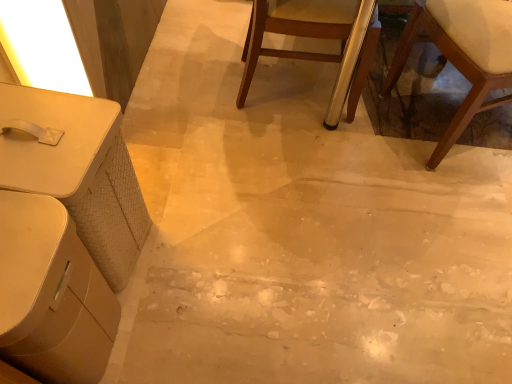
Question: Can you confirm if wooden chair at center, the 2th chair when ordered from right to left, is shorter than wooden chair with white cushion at lower right, which is counted as the second chair, starting from the left?

Choices:
 (A) no
 (B) yes

Answer: (B)

Question: Is wooden chair at center, the 2th chair when ordered from right to left, further to the viewer compared to wooden chair with white cushion at lower right, which is counted as the second chair, starting from the left?

Choices:
 (A) yes
 (B) no

Answer: (A)

Question: Could wooden chair with white cushion at lower right, positioned as the first chair in right-to-left order, be considered to be inside wooden chair at center, marked as the 1th chair in a left-to-right arrangement?

Choices:
 (A) yes
 (B) no

Answer: (B)

Question: Is wooden chair at center, the 2th chair when ordered from right to left, not close to wooden chair with white cushion at lower right, positioned as the first chair in right-to-left order?

Choices:
 (A) yes
 (B) no

Answer: (B)

Question: Can you confirm if wooden chair at center, the 2th chair when ordered from right to left, is smaller than wooden chair with white cushion at lower right, which is counted as the second chair, starting from the left?

Choices:
 (A) no
 (B) yes

Answer: (A)

Question: In terms of width, does white glossy table at lower left, arranged as the first table when ordered from the bottom, look wider or thinner when compared to wooden chair with white cushion at lower right, positioned as the first chair in right-to-left order?

Choices:
 (A) thin
 (B) wide

Answer: (A)

Question: From the image's perspective, is white glossy table at lower left, the second table positioned from the top, positioned above or below wooden chair with white cushion at lower right, positioned as the first chair in right-to-left order?

Choices:
 (A) below
 (B) above

Answer: (A)

Question: Is point (71, 279) closer or farther from the camera than point (415, 26)?

Choices:
 (A) closer
 (B) farther

Answer: (A)

Question: Is white glossy table at lower left, arranged as the first table when ordered from the bottom, bigger or smaller than wooden chair with white cushion at lower right, which is counted as the second chair, starting from the left?

Choices:
 (A) big
 (B) small

Answer: (B)

Question: In terms of width, does white glossy table at lower left, arranged as the first table when ordered from the bottom, look wider or thinner when compared to wooden chair at center, marked as the 1th chair in a left-to-right arrangement?

Choices:
 (A) thin
 (B) wide

Answer: (A)

Question: Is white glossy table at lower left, arranged as the first table when ordered from the bottom, taller or shorter than wooden chair at center, the 2th chair when ordered from right to left?

Choices:
 (A) short
 (B) tall

Answer: (A)

Question: Choose the correct answer: Is white glossy table at lower left, arranged as the first table when ordered from the bottom, inside wooden chair at center, the 2th chair when ordered from right to left, or outside it?

Choices:
 (A) inside
 (B) outside

Answer: (B)

Question: Visually, is white glossy table at lower left, arranged as the first table when ordered from the bottom, positioned to the left or to the right of wooden chair at center, marked as the 1th chair in a left-to-right arrangement?

Choices:
 (A) left
 (B) right

Answer: (A)

Question: Is wooden chair with white cushion at lower right, positioned as the first chair in right-to-left order, situated inside white glossy table at lower left, the second table positioned from the top, or outside?

Choices:
 (A) inside
 (B) outside

Answer: (B)

Question: Relative to white glossy table at lower left, arranged as the first table when ordered from the bottom, is wooden chair with white cushion at lower right, positioned as the first chair in right-to-left order, in front or behind?

Choices:
 (A) front
 (B) behind

Answer: (B)